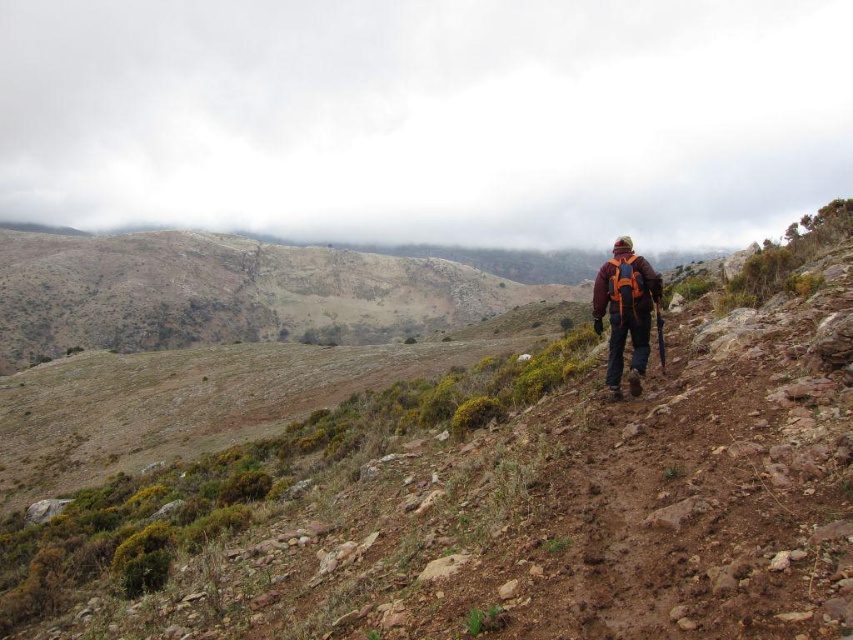
You are a hiker looking at the mountain trail. There is a point at coordinates (427, 116). What is located at that point?

The cloudy sky at upper center is located at point (427, 116).